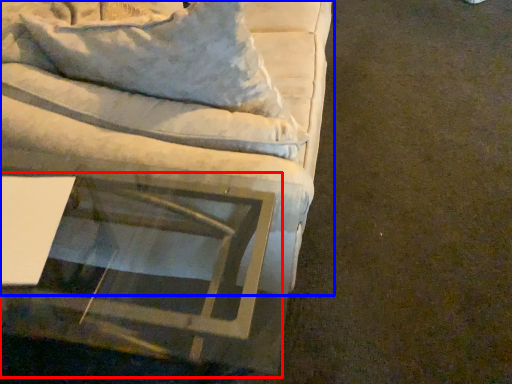
Question: Which point is further to the camera, round table (highlighted by a red box) or studio couch (highlighted by a blue box)?

Choices:
 (A) round table
 (B) studio couch

Answer: (B)